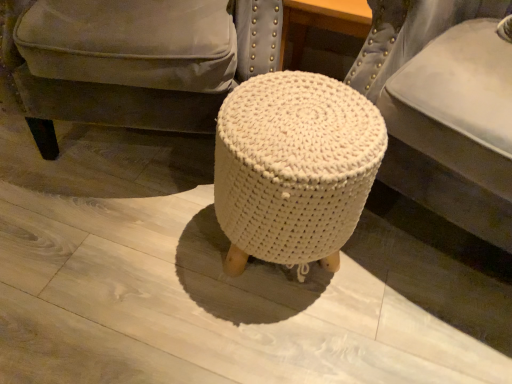
Image resolution: width=512 pixels, height=384 pixels. What are the coordinates of `white knitted stool at center` in the screenshot? It's located at (132, 60).

Describe the element at coordinates (294, 168) in the screenshot. This screenshot has height=384, width=512. I see `white knitted stool at center` at that location.

This screenshot has height=384, width=512. Identify the location of white knitted pouf at center. (409, 36).

In order to face white knitted pouf at center, should I rotate leftwards or rightwards?

Turn right by 29.223 degrees to look at white knitted pouf at center.

Image resolution: width=512 pixels, height=384 pixels. Find the location of `white knitted stool at center`. white knitted stool at center is located at coordinates (132, 60).

From the image's perspective, which is above, white knitted pouf at center or white knitted stool at center?

white knitted stool at center, from the image's perspective.

Is white knitted pouf at center turned away from white knitted stool at center?

No, white knitted stool at center is not at the back of white knitted pouf at center.

Is white knitted pouf at center taller or shorter than white knitted stool at center?

In the image, white knitted pouf at center appears to be taller than white knitted stool at center.

Would you say white knitted pouf at center is outside white knitted stool at center?

Yes, white knitted pouf at center is not within white knitted stool at center.

Is white knitted stool at center next to white knitted stool at center and touching it?

white knitted stool at center is not next to white knitted stool at center, and they're not touching.

Can white knitted stool at center be found inside white knitted stool at center?

Definitely not — white knitted stool at center is not inside white knitted stool at center.

Based on the photo, from a real-world perspective, is white knitted stool at center physically located above or below white knitted stool at center?

In terms of real-world spatial position, white knitted stool at center is below white knitted stool at center.

Does point (314, 181) appear closer or farther from the camera than point (266, 30)?

Clearly, point (314, 181) is closer to the camera than point (266, 30).

Can you confirm if white knitted stool at center is bigger than white knitted stool at center?

Indeed, white knitted stool at center has a larger size compared to white knitted stool at center.

Is the surface of white knitted stool at center in direct contact with white knitted stool at center?

white knitted stool at center and white knitted stool at center are clearly separated.

From the image's perspective, is white knitted stool at center below white knitted stool at center?

No, from the image's perspective, white knitted stool at center is not beneath white knitted stool at center.

What's the angular difference between white knitted stool at center and white knitted stool at center's facing directions?

23.7 degrees.

Between white knitted stool at center and white knitted pouf at center, which one has more height?

white knitted pouf at center is taller.

Could white knitted pouf at center be considered to be inside white knitted stool at center?

No, white knitted pouf at center is located outside of white knitted stool at center.

Which point is more distant from viewer, [230,119] or [479,209]?

The point [479,209] is farther.

From the image's perspective, is white knitted stool at center located above or below white knitted pouf at center?

Based on their image positions, white knitted stool at center is located beneath white knitted pouf at center.

Can you tell me how much white knitted stool at center and white knitted pouf at center differ in facing direction?

The facing directions of white knitted stool at center and white knitted pouf at center are 38.6 degrees apart.

Does white knitted stool at center touch white knitted pouf at center?

No, white knitted stool at center is not making contact with white knitted pouf at center.

From a real-world perspective, is white knitted stool at center physically above white knitted pouf at center?

Incorrect, from a real-world perspective, white knitted stool at center is lower than white knitted pouf at center.

Does point (213, 23) come in front of point (474, 229)?

No, (213, 23) is further to viewer.

From a real-world perspective, is white knitted pouf at center above or below white knitted stool at center?

white knitted pouf at center is situated higher than white knitted stool at center in the real world.

Choose the correct answer: Is white knitted pouf at center inside white knitted stool at center or outside it?

white knitted pouf at center is not enclosed by white knitted stool at center.

In terms of height, does white knitted pouf at center look taller or shorter compared to white knitted stool at center?

white knitted pouf at center is taller than white knitted stool at center.

Identify the location of furniture on the right of white knitted stool at center. (409, 36).

Where is `bar stool below the white knitted stool at center (from a real-world perspective)`? bar stool below the white knitted stool at center (from a real-world perspective) is located at coordinates (294, 168).

Estimate the real-world distances between objects in this image. Which object is further from white knitted stool at center, white knitted pouf at center or white knitted stool at center?

white knitted pouf at center lies further to white knitted stool at center than the other object.

From the image, which object appears to be nearer to white knitted stool at center, white knitted pouf at center or white knitted stool at center?

white knitted pouf at center is closer to white knitted stool at center.

Which object lies nearer to the anchor point white knitted pouf at center, white knitted stool at center or white knitted stool at center?

Based on the image, white knitted stool at center appears to be nearer to white knitted pouf at center.

When comparing their distances from white knitted stool at center, does white knitted stool at center or white knitted pouf at center seem further?

white knitted stool at center lies further to white knitted stool at center than the other object.

When comparing their distances from white knitted stool at center, does white knitted stool at center or white knitted pouf at center seem closer?

white knitted stool at center is closer to white knitted stool at center.

Considering their positions, is white knitted stool at center positioned closer to white knitted pouf at center than white knitted stool at center?

The object closer to white knitted pouf at center is white knitted stool at center.

At what (x,y) coordinates should I click in order to perform the action: click on bar stool between white knitted stool at center and white knitted pouf at center in the horizontal direction. Please return your answer as a coordinate pair (x, y). This screenshot has height=384, width=512. Looking at the image, I should click on pos(294,168).